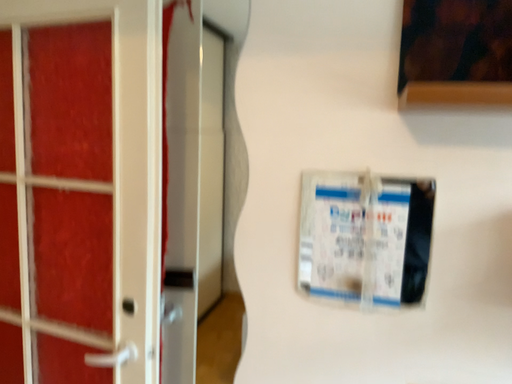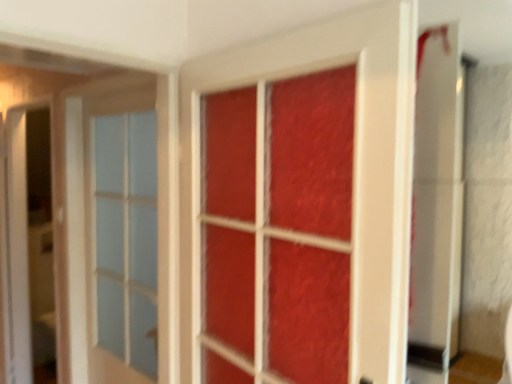
Question: Which way did the camera rotate in the video?

Choices:
 (A) rotated right
 (B) rotated left

Answer: (B)